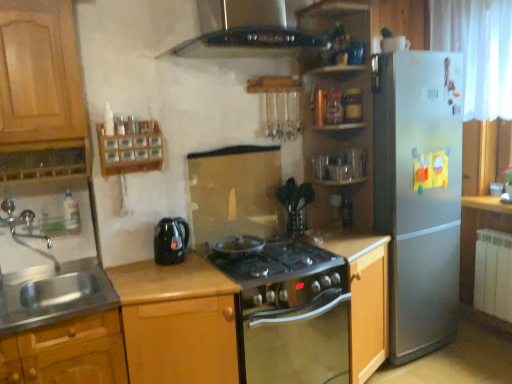
Question: From a real-world perspective, is metallic oak cabinet at lower left, which is the 3th cabinetry in right-to-left order, positioned over wooden cabinet at center, the second cabinetry viewed from the left, based on gravity?

Choices:
 (A) yes
 (B) no

Answer: (A)

Question: Is metallic oak cabinet at lower left, which is the 3th cabinetry in right-to-left order, next to wooden cabinet at center, the second cabinetry viewed from the left, and touching it?

Choices:
 (A) yes
 (B) no

Answer: (B)

Question: Is metallic oak cabinet at lower left, placed as the first cabinetry when sorted from left to right, located outside wooden cabinet at center, the second cabinetry viewed from the left?

Choices:
 (A) no
 (B) yes

Answer: (B)

Question: Could wooden cabinet at center, the second cabinetry viewed from the left, be considered to be inside metallic oak cabinet at lower left, which is the 3th cabinetry in right-to-left order?

Choices:
 (A) yes
 (B) no

Answer: (B)

Question: From the image's perspective, is metallic oak cabinet at lower left, placed as the first cabinetry when sorted from left to right, on top of wooden cabinet at center, which is counted as the second cabinetry, starting from the right?

Choices:
 (A) yes
 (B) no

Answer: (B)

Question: Is metallic oak cabinet at lower left, placed as the first cabinetry when sorted from left to right, far from wooden cabinet at center, which is counted as the second cabinetry, starting from the right?

Choices:
 (A) no
 (B) yes

Answer: (A)

Question: Does wooden cabinet at center, the first cabinetry when ordered from right to left, appear on the left side of black glass exhaust hood at upper center?

Choices:
 (A) no
 (B) yes

Answer: (A)

Question: Is wooden cabinet at center, the first cabinetry when ordered from right to left, surrounding black glass exhaust hood at upper center?

Choices:
 (A) yes
 (B) no

Answer: (B)

Question: Could you tell me if wooden cabinet at center, the first cabinetry when ordered from right to left, is facing black glass exhaust hood at upper center?

Choices:
 (A) yes
 (B) no

Answer: (B)

Question: Can you confirm if wooden cabinet at center, placed as the third cabinetry when sorted from left to right, is smaller than black glass exhaust hood at upper center?

Choices:
 (A) yes
 (B) no

Answer: (B)

Question: Is wooden cabinet at center, the first cabinetry when ordered from right to left, to the right of black glass exhaust hood at upper center from the viewer's perspective?

Choices:
 (A) yes
 (B) no

Answer: (A)

Question: Is wooden cabinet at center, placed as the third cabinetry when sorted from left to right, positioned with its back to black glass exhaust hood at upper center?

Choices:
 (A) yes
 (B) no

Answer: (B)

Question: Could you tell me if black glass exhaust hood at upper center is turned towards silver metallic refrigerator at right?

Choices:
 (A) yes
 (B) no

Answer: (B)